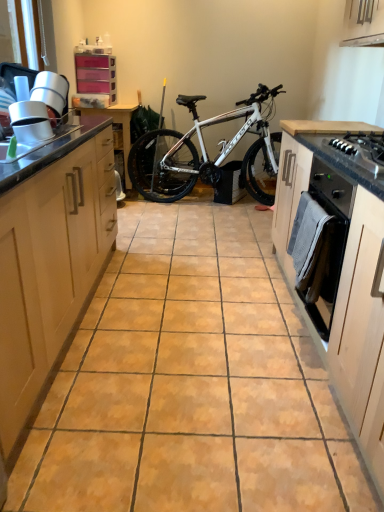
Question: Considering the positions of black glossy gas stove at right and light wood cabinet at left, positioned as the 2th cabinetry in right-to-left order, in the image, is black glossy gas stove at right taller or shorter than light wood cabinet at left, positioned as the 2th cabinetry in right-to-left order,?

Choices:
 (A) tall
 (B) short

Answer: (B)

Question: From a real-world perspective, is black glossy gas stove at right physically located above or below light wood cabinet at left, the first cabinetry positioned from the left?

Choices:
 (A) below
 (B) above

Answer: (B)

Question: Based on their relative distances, which object is farther from the light wood cabinet at left, the first cabinetry positioned from the left?

Choices:
 (A) light wood oven at right, which ranks as the first cabinetry in right-to-left order
 (B) black glossy gas stove at right
 (C) wooden table at center
 (D) black matte oven at right
 (E) white metallic bicycle at center

Answer: (E)

Question: Which is nearer to the wooden table at center?

Choices:
 (A) black matte oven at right
 (B) light wood oven at right, placed as the second cabinetry when sorted from left to right
 (C) black glossy gas stove at right
 (D) white metallic bicycle at center
 (E) light wood cabinet at left, positioned as the 2th cabinetry in right-to-left order

Answer: (D)